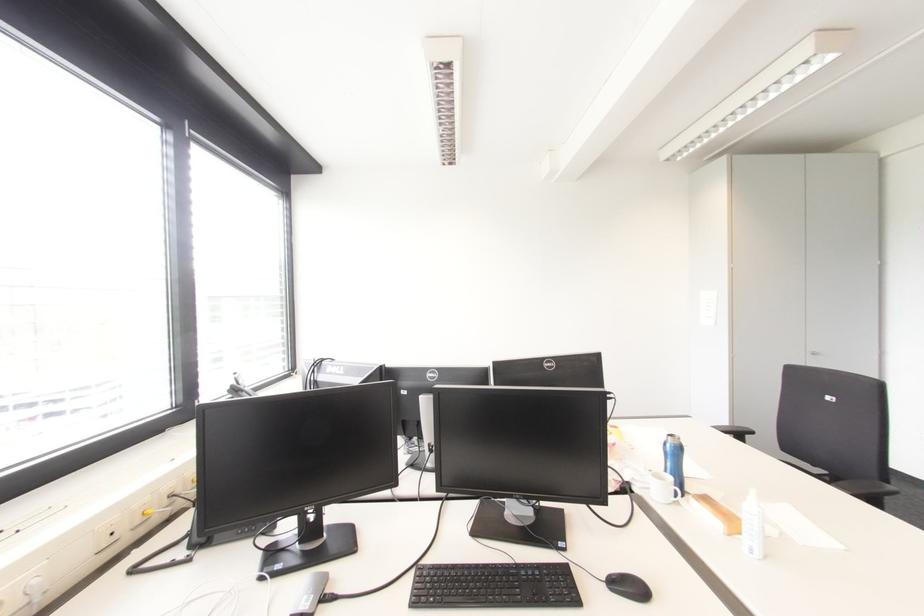
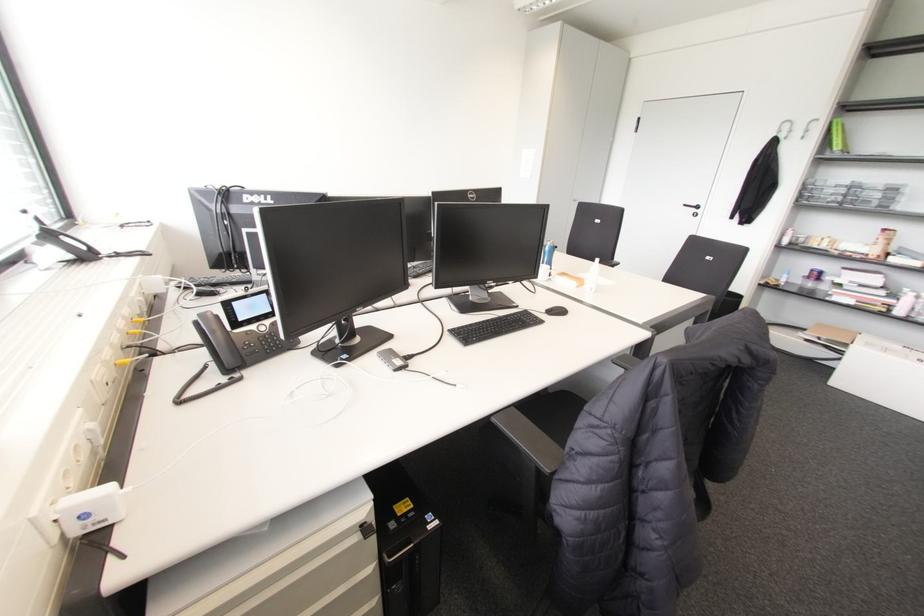
The images are taken continuously from a first-person perspective. In which direction is your viewpoint rotating?

The camera rotated toward right-down.